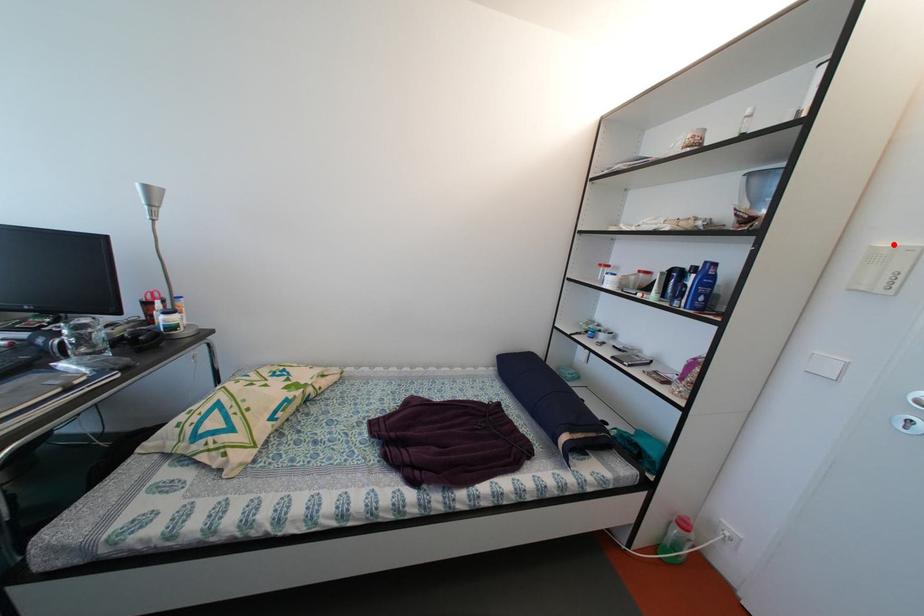
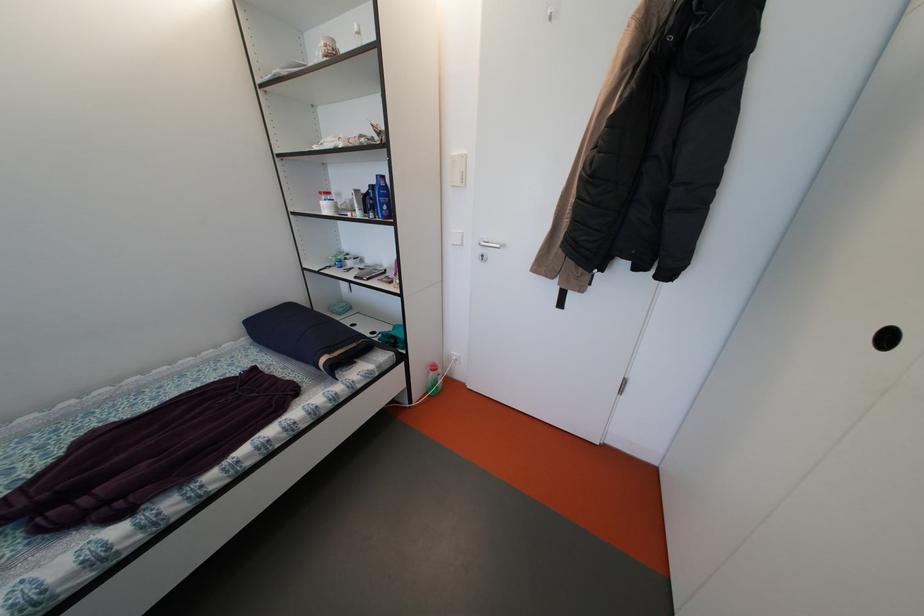
Find the pixel in the second image that matches the highlighted location in the first image.

(462, 156)